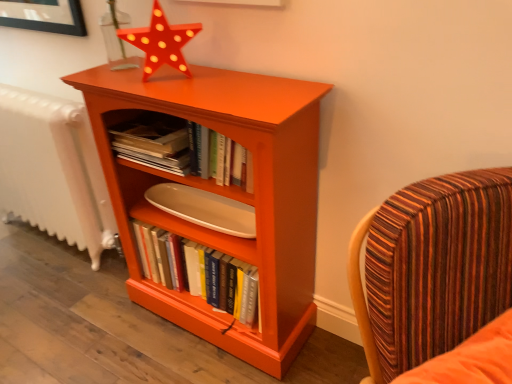
Question: From the image's perspective, is orange matte wood bookcase at center located above or below white textured radiator at left?

Choices:
 (A) below
 (B) above

Answer: (A)

Question: Is orange matte wood bookcase at center in front of or behind white textured radiator at left in the image?

Choices:
 (A) front
 (B) behind

Answer: (A)

Question: Which object is the closest to the hardcover books at center, marked as the first book in a bottom-to-top arrangement?

Choices:
 (A) white textured radiator at left
 (B) matte orange shelf at center
 (C) matte orange star at upper center
 (D) orange matte wood bookcase at center
 (E) striped fabric chair at right

Answer: (B)

Question: Considering the real-world distances, which object is closest to the hardcover books at center, positioned as the 2th book in top-to-bottom order?

Choices:
 (A) orange matte wood bookcase at center
 (B) hardcover books at center, which appears as the first book when viewed from the top
 (C) striped fabric chair at right
 (D) matte orange shelf at center
 (E) white textured radiator at left

Answer: (D)